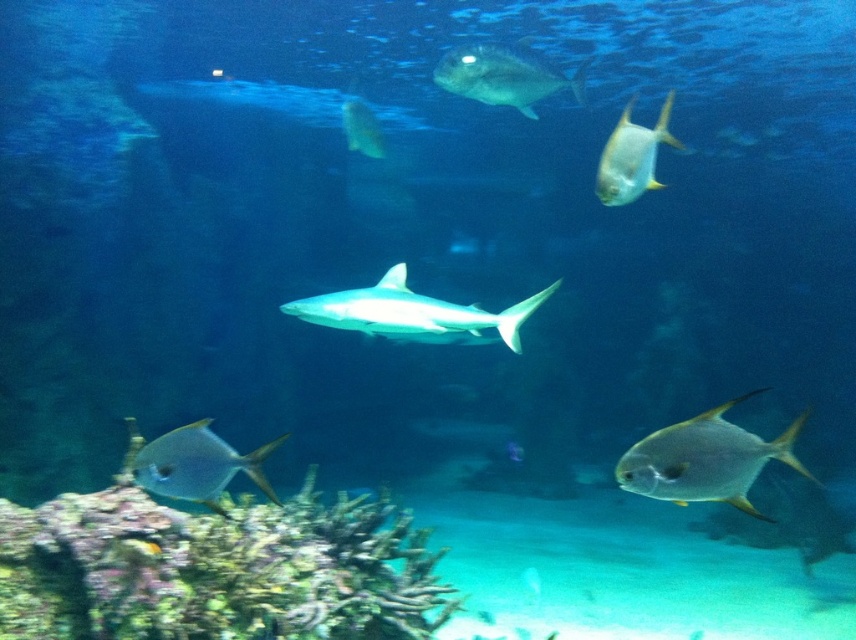
You are a marine biologist observing the underwater scene in the aquarium. You notice the shiny silver fish at upper right. Can you determine its exact position relative to the aquarium tank?

The shiny silver fish at upper right is located at point 0.245 on the horizontal axis and 0.739 on the vertical axis within the aquarium tank.

You are a marine biologist observing this underwater scene. You need to take a closeup photo of the shiny silver fish at upper right using a camera that has a minimum focusing distance of 7 feet. Can you take the photo without moving the camera?

The shiny silver fish at upper right and camera are 7.35 feet apart from each other. Since the minimum focusing distance is 7 feet, the camera can focus on the shiny silver fish at upper right as the distance is within the required range.